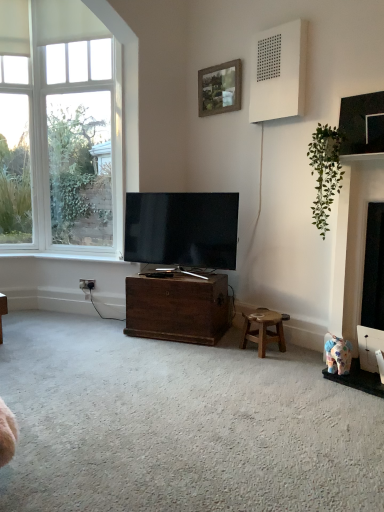
Question: Is fluffy fabric elephant at lower right wider or thinner than green leafy plant at upper right?

Choices:
 (A) wide
 (B) thin

Answer: (B)

Question: In the image, is fluffy fabric elephant at lower right on the left side or the right side of green leafy plant at upper right?

Choices:
 (A) right
 (B) left

Answer: (A)

Question: Which object is the farthest from the clear glass window at left?

Choices:
 (A) white matte speaker at upper right
 (B) fluffy fabric elephant at lower right
 (C) dark brown wood chest at center
 (D) white painted wood at lower left
 (E) green leafy plant at upper right

Answer: (B)

Question: Which of these objects is positioned closest to the matte black tv at center?

Choices:
 (A) fluffy fabric elephant at lower right
 (B) white matte speaker at upper right
 (C) green leafy plant at upper right
 (D) dark brown wood chest at center
 (E) white plastic power outlet at lower left

Answer: (D)